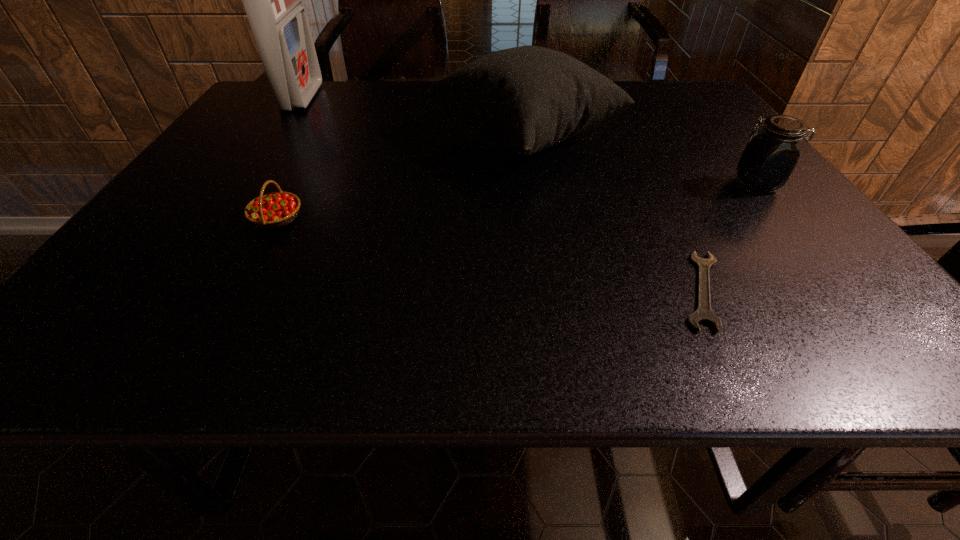
The height and width of the screenshot is (540, 960). I want to click on vacant region that satisfies the following two spatial constraints: 1. on the front-facing side of the tallest object; 2. on the back side of the strawberry, so click(x=221, y=219).

The height and width of the screenshot is (540, 960). Identify the location of vacant space that satisfies the following two spatial constraints: 1. on the back side of the strawberry; 2. on the front-facing side of the leftmost object. (342, 98).

Find the location of a particular element. free space that satisfies the following two spatial constraints: 1. on the front side of the second shortest object; 2. on the left side of the shortest object is located at coordinates (240, 291).

The image size is (960, 540). I want to click on vacant region that satisfies the following two spatial constraints: 1. on the front-facing side of the tallest object; 2. on the left side of the fourth tallest object, so click(x=221, y=219).